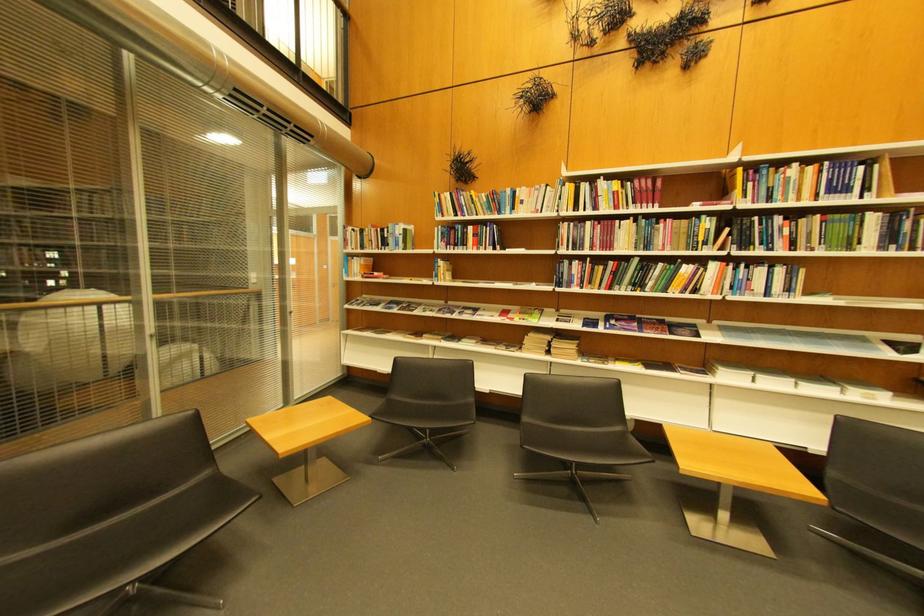
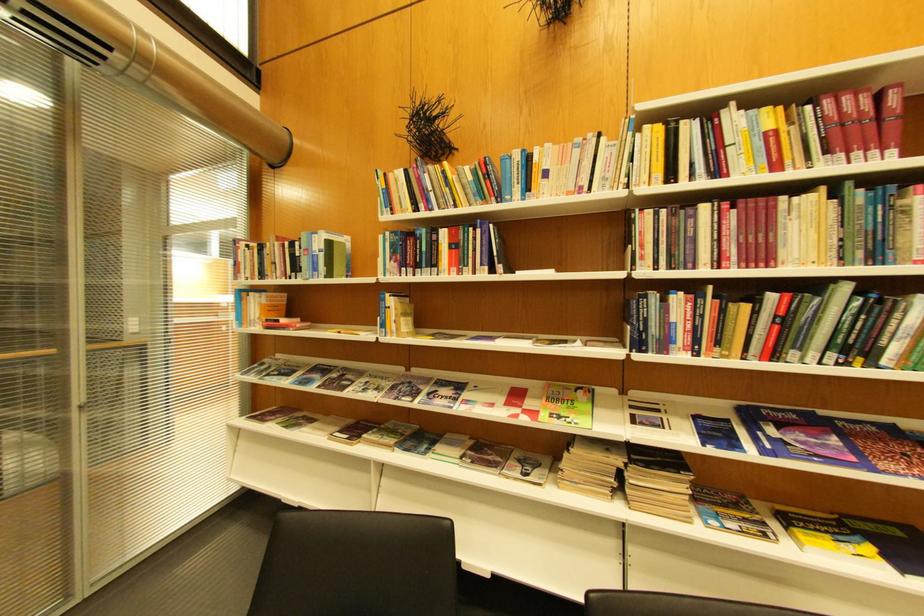
Question: Which direction would the cameraman need to move to produce the second image? Reply with the corresponding letter.

Choices:
 (A) Left
 (B) Right
 (C) Forward
 (D) Backward

Answer: (C)